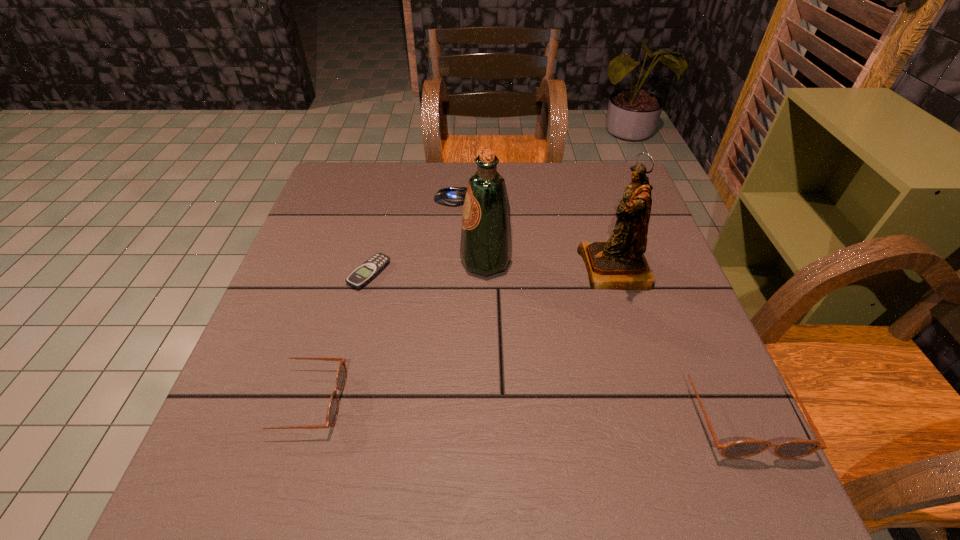
This screenshot has width=960, height=540. I want to click on free point located on the button side of the computer mouse, so click(x=593, y=199).

Locate an element on the screen. Image resolution: width=960 pixels, height=540 pixels. blank space located 0.350m on the front-facing side of the figurine is located at coordinates (432, 269).

I want to click on vacant area situated 0.250m on the front-facing side of the figurine, so click(x=474, y=269).

I want to click on vacant space situated on the front-facing side of the figurine, so click(x=462, y=269).

Where is `vacant space positioned 0.050m on the front-facing side of the olive oil`? The image size is (960, 540). vacant space positioned 0.050m on the front-facing side of the olive oil is located at coordinates (440, 262).

The width and height of the screenshot is (960, 540). I want to click on blank space located on the front-facing side of the olive oil, so click(381, 262).

Find the location of `vacant space located 0.190m on the front-facing side of the olive oil`. vacant space located 0.190m on the front-facing side of the olive oil is located at coordinates (381, 262).

Find the location of `blank space located 0.220m on the front of the beeper`. blank space located 0.220m on the front of the beeper is located at coordinates click(x=343, y=376).

You are a GUI agent. You are given a task and a screenshot of the screen. Output one action in this format:
    pyautogui.click(x=<x>, y=<y>)
    Task: Click on the object that is at the far edge
    This screenshot has height=540, width=960.
    Given the screenshot: What is the action you would take?
    pyautogui.click(x=451, y=196)

The image size is (960, 540). What are the coordinates of `sunglasses located at the left edge` in the screenshot? It's located at (332, 412).